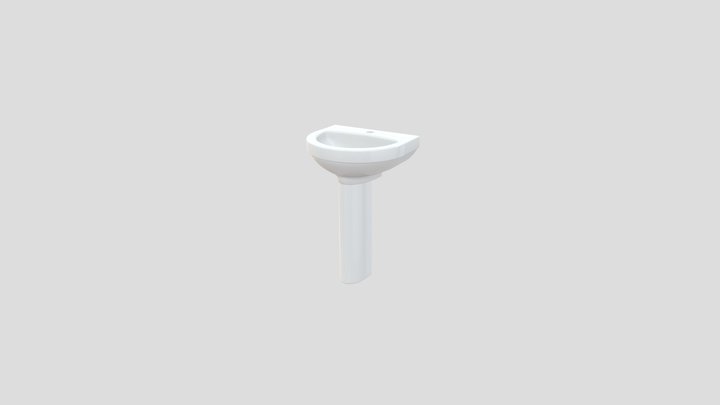
Identify the location of back of sink. The width and height of the screenshot is (720, 405). 369,229.